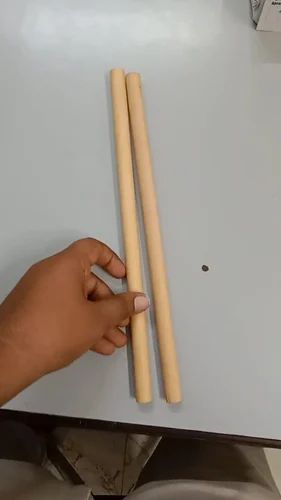
This screenshot has height=500, width=281. I want to click on edge of table, so click(186, 432).